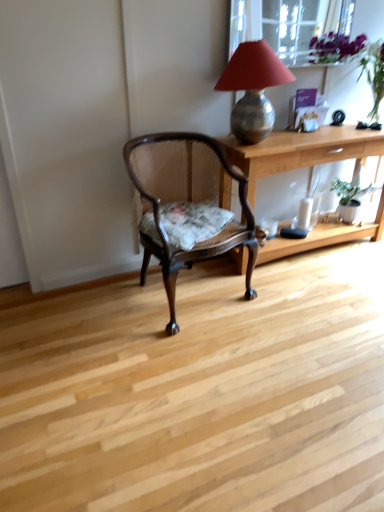
Image resolution: width=384 pixels, height=512 pixels. I want to click on free space on the front side of light wood desk at center, so click(309, 307).